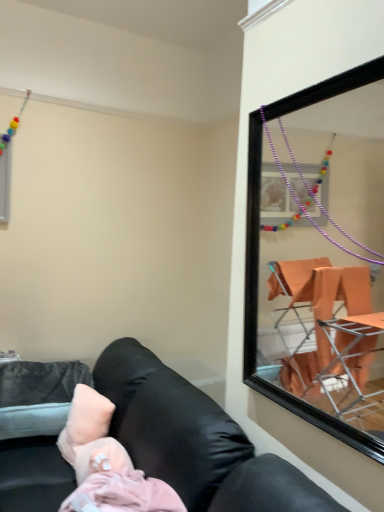
Question: Is pink fabric pillow at lower left outside black leather couch at lower left?

Choices:
 (A) no
 (B) yes

Answer: (A)

Question: Does pink fabric pillow at lower left lie in front of black leather couch at lower left?

Choices:
 (A) yes
 (B) no

Answer: (B)

Question: Would you say pink fabric pillow at lower left contains black leather couch at lower left?

Choices:
 (A) no
 (B) yes

Answer: (A)

Question: From a real-world perspective, is pink fabric pillow at lower left located higher than black leather couch at lower left?

Choices:
 (A) yes
 (B) no

Answer: (A)

Question: Is pink fabric pillow at lower left turned away from black leather couch at lower left?

Choices:
 (A) yes
 (B) no

Answer: (A)

Question: Is pink fabric pillow at lower left with black leather couch at lower left?

Choices:
 (A) no
 (B) yes

Answer: (A)

Question: Is pink fabric pillow at lower left completely or partially outside of pink fabric at lower left?

Choices:
 (A) no
 (B) yes

Answer: (B)

Question: Is pink fabric pillow at lower left oriented away from pink fabric at lower left?

Choices:
 (A) yes
 (B) no

Answer: (B)

Question: Can you confirm if pink fabric pillow at lower left is taller than pink fabric at lower left?

Choices:
 (A) yes
 (B) no

Answer: (A)

Question: Can you confirm if pink fabric pillow at lower left is bigger than pink fabric at lower left?

Choices:
 (A) no
 (B) yes

Answer: (A)

Question: Is pink fabric pillow at lower left not near pink fabric at lower left?

Choices:
 (A) no
 (B) yes

Answer: (A)

Question: Is pink fabric pillow at lower left placed right next to pink fabric at lower left?

Choices:
 (A) no
 (B) yes

Answer: (A)

Question: From a real-world perspective, is black leather couch at lower left on pink fabric pillow at lower left?

Choices:
 (A) no
 (B) yes

Answer: (A)